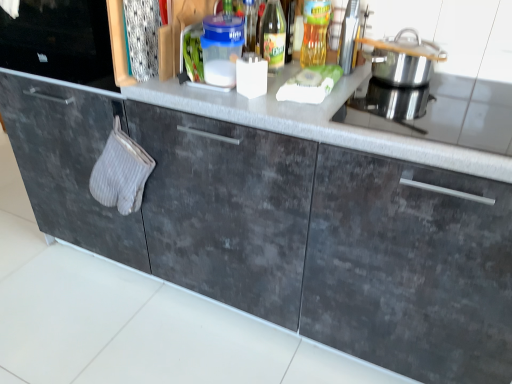
Question: Is silver metallic pot at upper right located outside transparent glass bottle at center, acting as the first bottle starting from the right?

Choices:
 (A) no
 (B) yes

Answer: (B)

Question: Is silver metallic pot at upper right wider than transparent glass bottle at center, the second bottle viewed from the left?

Choices:
 (A) yes
 (B) no

Answer: (A)

Question: Would you say transparent glass bottle at center, acting as the first bottle starting from the right, is part of silver metallic pot at upper right's contents?

Choices:
 (A) no
 (B) yes

Answer: (A)

Question: Can you confirm if silver metallic pot at upper right is shorter than transparent glass bottle at center, acting as the first bottle starting from the right?

Choices:
 (A) no
 (B) yes

Answer: (B)

Question: From a real-world perspective, is silver metallic pot at upper right under transparent glass bottle at center, the second bottle viewed from the left?

Choices:
 (A) yes
 (B) no

Answer: (A)

Question: Is metallic silver toaster at upper right to the left or to the right of transparent glass bottle at center, acting as the first bottle starting from the right, in the image?

Choices:
 (A) right
 (B) left

Answer: (A)

Question: From a real-world perspective, is metallic silver toaster at upper right physically located above or below transparent glass bottle at center, acting as the first bottle starting from the right?

Choices:
 (A) above
 (B) below

Answer: (A)

Question: Considering the positions of metallic silver toaster at upper right and transparent glass bottle at center, the second bottle viewed from the left, in the image, is metallic silver toaster at upper right taller or shorter than transparent glass bottle at center, the second bottle viewed from the left,?

Choices:
 (A) tall
 (B) short

Answer: (B)

Question: Would you say metallic silver toaster at upper right is inside or outside transparent glass bottle at center, acting as the first bottle starting from the right?

Choices:
 (A) inside
 (B) outside

Answer: (B)

Question: From the image's perspective, is translucent glass bottle at upper center, the 2th bottle in the right-to-left sequence, positioned above or below gray textured oven mitt at left?

Choices:
 (A) below
 (B) above

Answer: (B)

Question: Is translucent glass bottle at upper center, the 2th bottle in the right-to-left sequence, in front of or behind gray textured oven mitt at left in the image?

Choices:
 (A) front
 (B) behind

Answer: (A)

Question: From their relative heights in the image, would you say translucent glass bottle at upper center, which ranks as the first bottle in left-to-right order, is taller or shorter than gray textured oven mitt at left?

Choices:
 (A) short
 (B) tall

Answer: (A)

Question: In terms of width, does translucent glass bottle at upper center, the 2th bottle in the right-to-left sequence, look wider or thinner when compared to gray textured oven mitt at left?

Choices:
 (A) thin
 (B) wide

Answer: (A)

Question: Is transparent glass bottle at center, acting as the first bottle starting from the right, taller or shorter than translucent glass bottle at upper center, the 2th bottle in the right-to-left sequence?

Choices:
 (A) short
 (B) tall

Answer: (B)

Question: From a real-world perspective, is transparent glass bottle at center, the second bottle viewed from the left, above or below translucent glass bottle at upper center, which ranks as the first bottle in left-to-right order?

Choices:
 (A) below
 (B) above

Answer: (B)